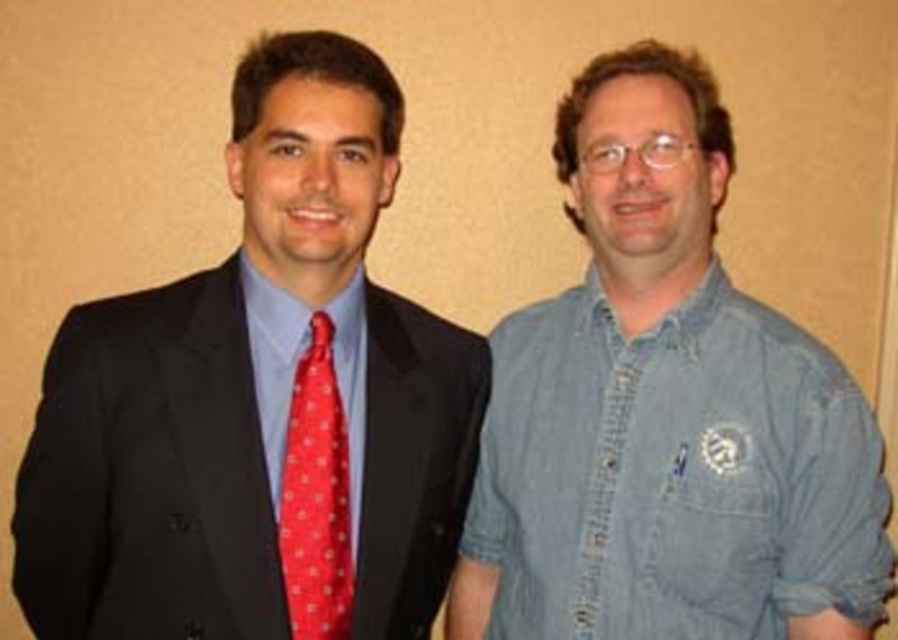
Question: Which object is the farthest from the denim shirt at right?

Choices:
 (A) red dotted fabric tie at left
 (B) matte black suit at left

Answer: (A)

Question: Is matte black suit at left smaller than red dotted fabric tie at left?

Choices:
 (A) yes
 (B) no

Answer: (B)

Question: Which of the following is the closest to the observer?

Choices:
 (A) matte black suit at left
 (B) red dotted fabric tie at left
 (C) denim shirt at right

Answer: (A)

Question: Does denim shirt at right have a lesser width compared to red dotted fabric tie at left?

Choices:
 (A) no
 (B) yes

Answer: (A)

Question: Is denim shirt at right positioned at the back of red dotted fabric tie at left?

Choices:
 (A) yes
 (B) no

Answer: (A)

Question: Which object appears farthest from the camera in this image?

Choices:
 (A) red dotted fabric tie at left
 (B) denim shirt at right

Answer: (B)